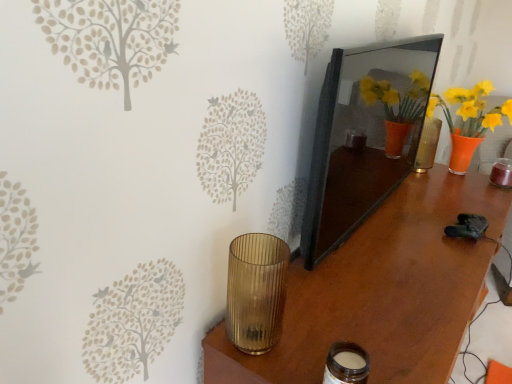
The image size is (512, 384). In order to click on vacant space behind gold ribbed glass at lower left, which appears as the 1th candle holder when viewed from the left in this screenshot , I will do point(284,297).